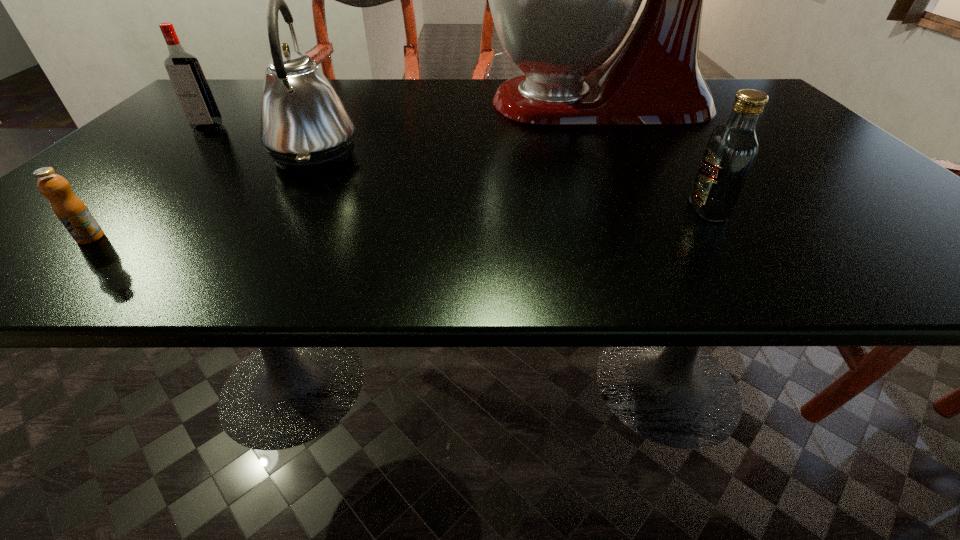
The image size is (960, 540). What are the coordinates of `orange juice that is at the left edge` in the screenshot? It's located at (x=72, y=212).

The height and width of the screenshot is (540, 960). What are the coordinates of `object positioned at the right edge` in the screenshot? It's located at (562, 0).

In order to click on object at the near left corner in this screenshot , I will do `click(72, 212)`.

Locate an element on the screen. object at the far right corner is located at coordinates (562, 0).

Where is `vacant region at the far edge of the desktop`? This screenshot has height=540, width=960. vacant region at the far edge of the desktop is located at coordinates (426, 93).

The width and height of the screenshot is (960, 540). I want to click on vacant region at the near edge, so click(x=501, y=247).

Identify the location of free spot at the left edge of the desktop. This screenshot has width=960, height=540. (210, 145).

This screenshot has height=540, width=960. In order to click on vacant region at the far left corner of the desktop in this screenshot , I will do [247, 100].

Identify the location of vacant area that lies between the orange juice and the farther vodka. This screenshot has width=960, height=540. (149, 183).

Find the location of `free space between the right vodka and the nearest object`. free space between the right vodka and the nearest object is located at coordinates (399, 223).